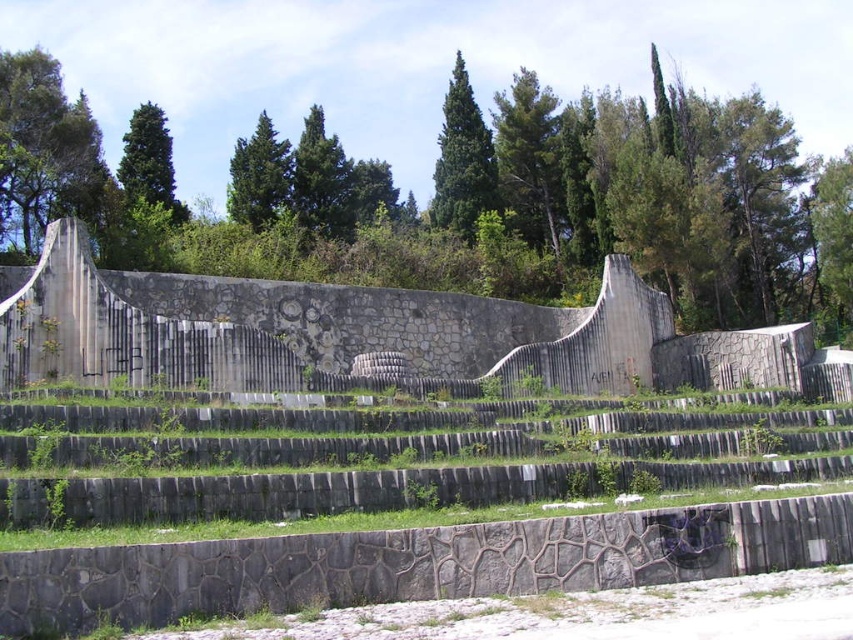
Image resolution: width=853 pixels, height=640 pixels. Describe the element at coordinates (376, 412) in the screenshot. I see `stone amphitheater at center` at that location.

Who is more forward, [433,428] or [750,93]?

Point [433,428] is in front.

Where is `stone amphitheater at center`? The height and width of the screenshot is (640, 853). stone amphitheater at center is located at coordinates (376, 412).

Is green leafy tree at upper left positioned before green textured pine at center?

Yes, it is in front of green textured pine at center.

The image size is (853, 640). I want to click on green leafy tree at upper left, so (45, 156).

Between green leafy tree at upper center and green leafy tree at upper left, which one appears on the right side from the viewer's perspective?

From the viewer's perspective, green leafy tree at upper center appears more on the right side.

Is green leafy tree at upper center positioned at the back of green leafy tree at upper left?

No.

What are the coordinates of `green leafy tree at upper center` in the screenshot? It's located at (500, 204).

At what (x,y) coordinates should I click in order to perform the action: click on green leafy tree at upper center. Please return your answer as a coordinate pair (x, y). The height and width of the screenshot is (640, 853). Looking at the image, I should click on (500, 204).